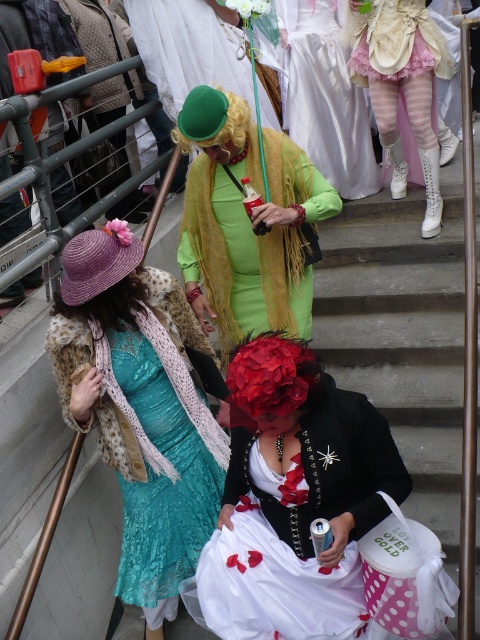
Who is more distant from viewer, (x=415, y=33) or (x=191, y=99)?

The point (x=415, y=33) is behind.

Which is more to the left, white striped tights at center or green woolen wig at center?

Positioned to the left is green woolen wig at center.

Between point (397, 140) and point (216, 138), which one is positioned behind?

The point (397, 140) is more distant.

You are a GUI agent. You are given a task and a screenshot of the screen. Output one action in this format:
    pyautogui.click(x=<x>, y=<y>)
    Task: Click on the white striped tights at center
    
    Given the screenshot: What is the action you would take?
    pyautogui.click(x=400, y=84)

Is white satin dress at upper center below green felt hat at center?

Correct, white satin dress at upper center is located below green felt hat at center.

Can you confirm if white satin dress at upper center is positioned above green felt hat at center?

No, white satin dress at upper center is not above green felt hat at center.

Between point (287, 51) and point (184, 76), which one is positioned behind?

Positioned behind is point (287, 51).

Locate an element on the screen. The image size is (480, 640). white satin dress at upper center is located at coordinates (324, 97).

Does teal lace dress at center have a greater width compared to white satin dress at upper center?

In fact, teal lace dress at center might be narrower than white satin dress at upper center.

Which of these two, teal lace dress at center or white satin dress at upper center, stands taller?

teal lace dress at center is taller.

Who is more forward, (x=116, y=272) or (x=339, y=124)?

Positioned in front is point (x=116, y=272).

Where is `teal lace dress at center`? The height and width of the screenshot is (640, 480). teal lace dress at center is located at coordinates (140, 408).